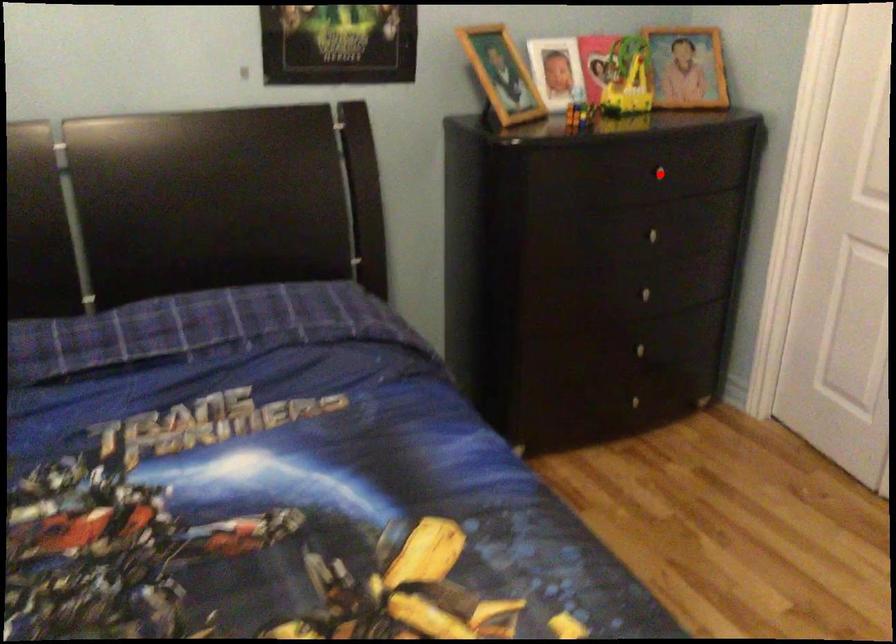
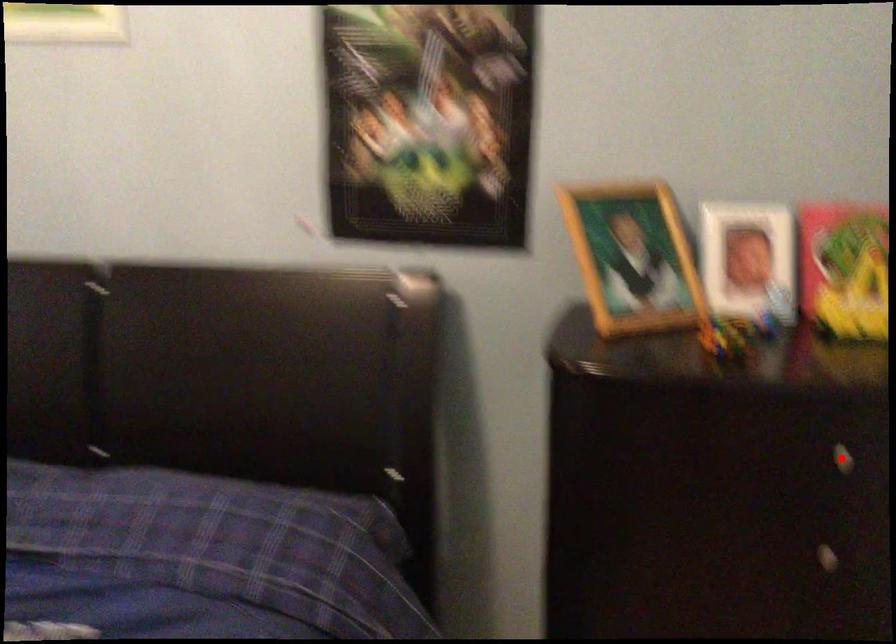
I am providing you with two images of the same scene from different viewpoints. A red point is marked on the first image and another point is marked on the second image. Are the points marked in image1 and image2 representing the same 3D position?

Yes